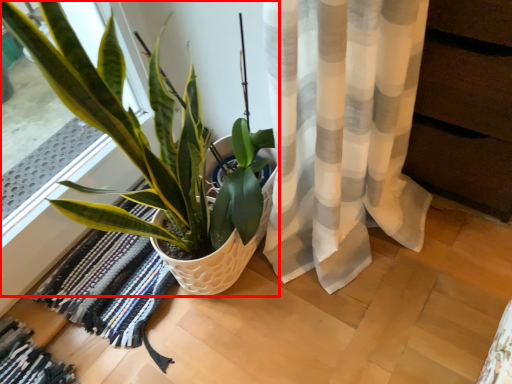
Question: In this image, where is houseplant (annotated by the red box) located relative to mat?

Choices:
 (A) right
 (B) left

Answer: (A)